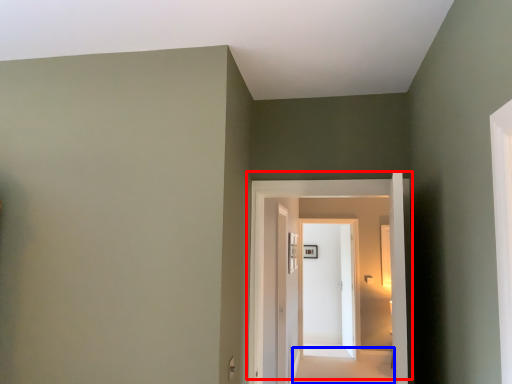
Question: Which point is further to the camera, door (highlighted by a red box) or path (highlighted by a blue box)?

Choices:
 (A) door
 (B) path

Answer: (B)